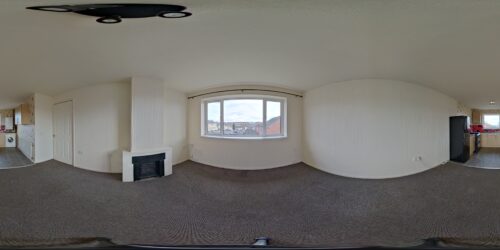
Find the location of a particular element. tile floors on left and right side is located at coordinates (482, 160), (21, 161).